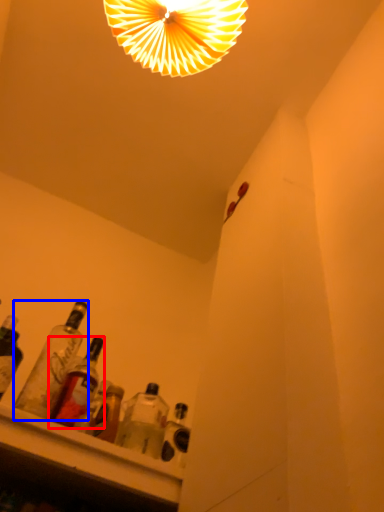
Question: Which of the following is the farthest to the observer, bottle (highlighted by a red box) or bottle (highlighted by a blue box)?

Choices:
 (A) bottle
 (B) bottle

Answer: (A)